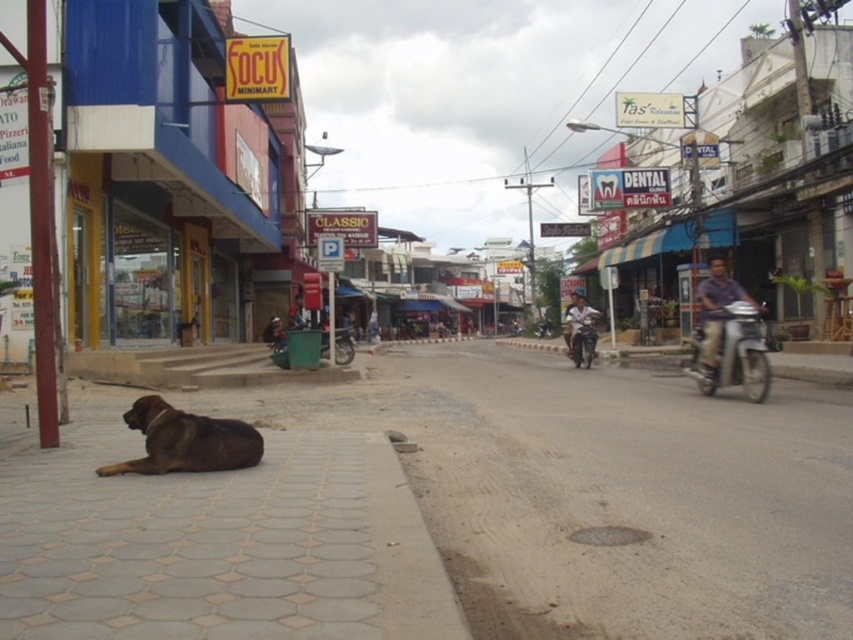
You are standing on the sidewalk and want to step onto the brown paving stone at lower left and the brown stone pavement at lower left. Which one can you step on first if you move forward directly?

The brown paving stone at lower left is larger in size than brown stone pavement at lower left, so you can step on the brown paving stone at lower left first as it is closer to your current position.

You are standing on the sidewalk and want to walk from point (633, 477) to point (78, 538). Which direction should you face to move towards the second point?

You should face downward because point (633, 477) is further to the viewer than point (78, 538). Since the second point is closer to the camera, moving towards it would require facing downward from the first point.